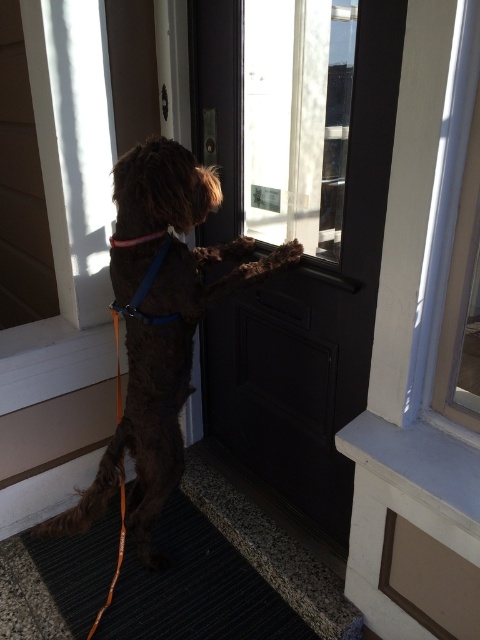
You are a delivery person who needs to place a package on the dark gray textured mat at lower center. The brown furry dog at center is blocking the mat. Can you step around the dog to place the package without moving the dog?

The brown furry dog at center and dark gray textured mat at lower center are 17.20 inches apart from each other. Since the distance between them is only 17.20 inches, it would be difficult to step around the dog to place the package without moving the dog.

You are standing on a porch and want to open the black wooden door at center. The dog is trying to reach the handle, but its leash is only 3 feet long. Can the dog reach the handle without moving closer to the door?

The distance between the black wooden door at center and the viewer is 4.17 feet. Since the leash is only 3 feet long, the dog cannot reach the handle without moving closer to the door.